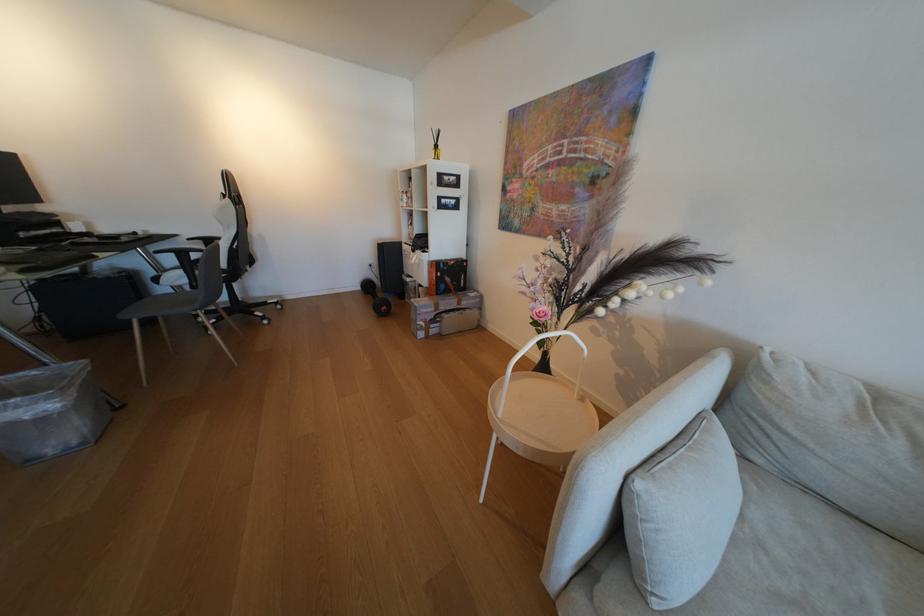
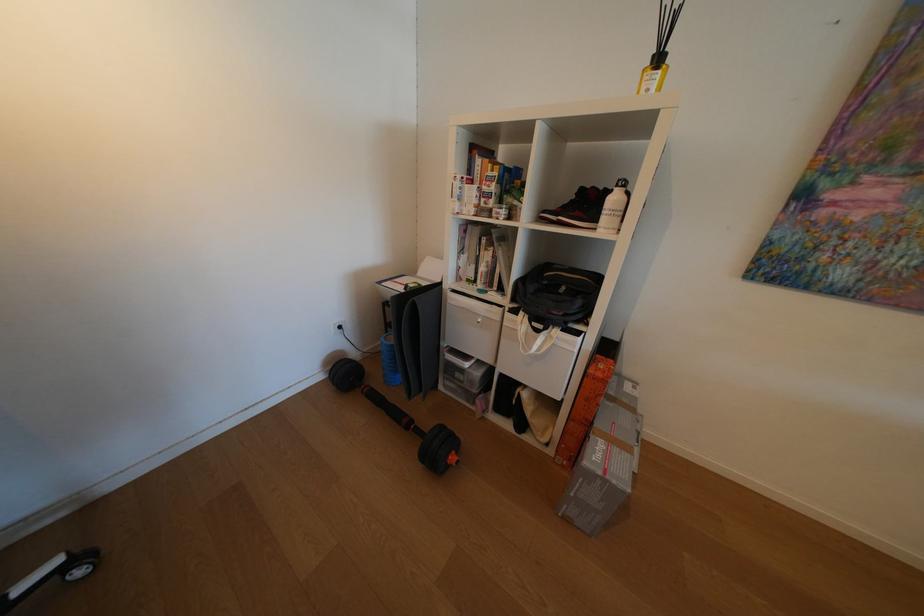
The point at (424, 253) is marked in the first image. Where is the corresponding point in the second image?

(548, 331)